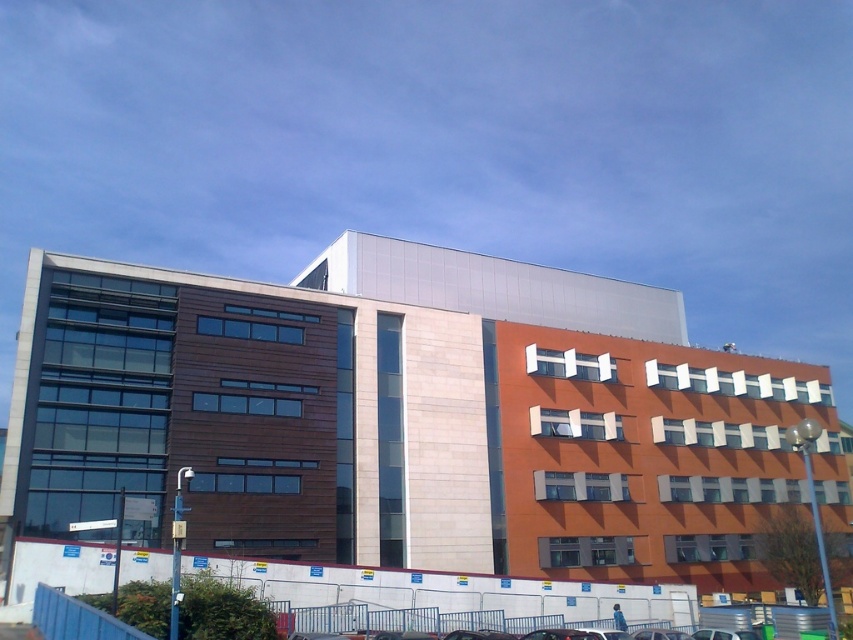
You are standing at the entrance of the modern multi story building and see a metallic silver car at lower center. Where is the point with coordinates (x=699, y=634) located?

The point with coordinates (x=699, y=634) is located on the metallic silver car at lower center.

You are a delivery driver who needs to park your truck in the parking lot shown in the image. You see a metallic silver car at lower center and a shiny black car at center. Can you safely drive your truck between these two cars without hitting either?

The metallic silver car at lower center is positioned under the shiny black car at center, so driving between them may not be possible as they are likely stacked vertically. Since trucks are larger, this would be unsafe and impractical.